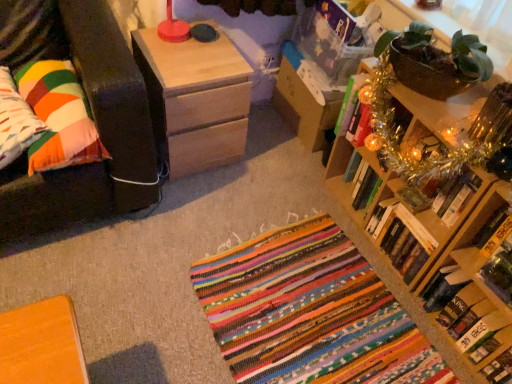
At what (x,y) coordinates should I click in order to perform the action: click on free space in front of natural wood nightstand at upper left. Please return your answer as a coordinate pair (x, y). The width and height of the screenshot is (512, 384). Looking at the image, I should click on (194, 203).